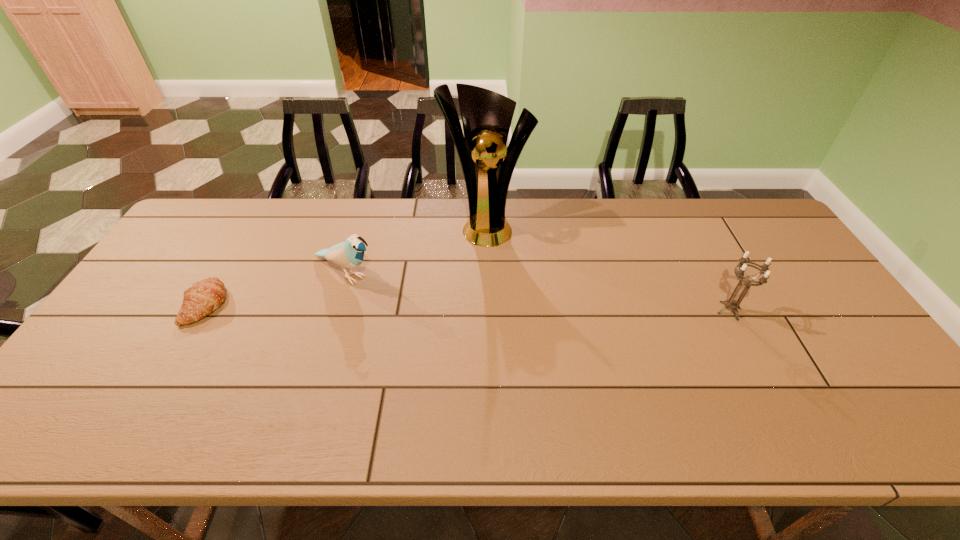
Find the location of a particular element. free region located 0.300m at the face of the second object from left to right is located at coordinates (455, 331).

Locate an element on the screen. The width and height of the screenshot is (960, 540). vacant space situated at the front of the farthest object, where the globe is visible is located at coordinates (505, 295).

Identify the location of vacant space situated at the front of the farthest object, where the globe is visible. This screenshot has width=960, height=540. pos(501,280).

This screenshot has width=960, height=540. In order to click on free region located 0.140m at the front of the farthest object, where the globe is visible in this screenshot , I will do `click(500, 278)`.

The width and height of the screenshot is (960, 540). I want to click on object at the far edge, so click(x=486, y=116).

Locate an element on the screen. The image size is (960, 540). object present at the left edge is located at coordinates (200, 300).

Locate an element on the screen. The width and height of the screenshot is (960, 540). free space at the far edge is located at coordinates (300, 210).

The height and width of the screenshot is (540, 960). In the image, there is a desktop. Find the location of `vacant space at the near edge`. vacant space at the near edge is located at coordinates (722, 388).

Identify the location of vacant space at the left edge of the desktop. (162, 264).

Locate an element on the screen. vacant space at the right edge is located at coordinates (774, 275).